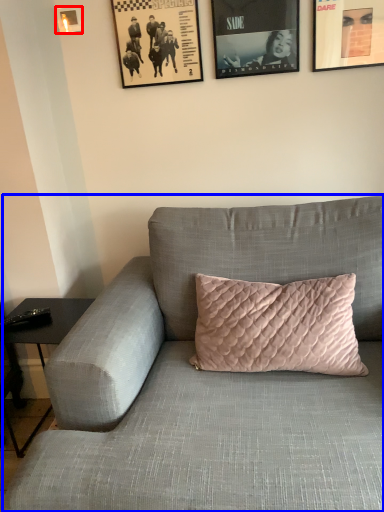
Question: Among these objects, which one is nearest to the camera, picture frame (highlighted by a red box) or studio couch (highlighted by a blue box)?

Choices:
 (A) picture frame
 (B) studio couch

Answer: (B)